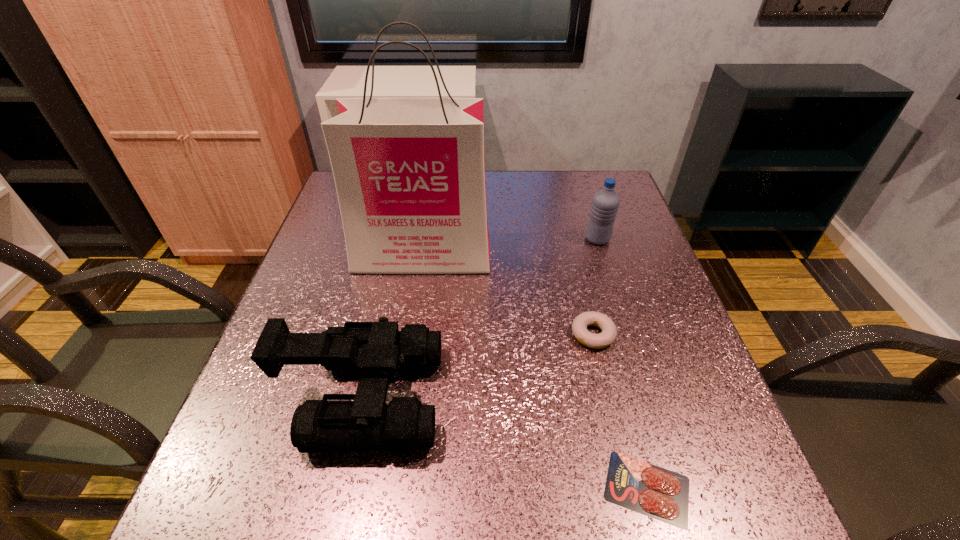
This screenshot has width=960, height=540. Find the location of `object located in the near edge section of the desktop`. object located in the near edge section of the desktop is located at coordinates (639, 486).

Locate an element on the screen. The height and width of the screenshot is (540, 960). shopping bag located at the left edge is located at coordinates (409, 173).

Find the location of a particular element. The image size is (960, 540). binoculars that is at the left edge is located at coordinates (375, 350).

At what (x,y) coordinates should I click in order to perform the action: click on water bottle situated at the right edge. Please return your answer as a coordinate pair (x, y). The width and height of the screenshot is (960, 540). Looking at the image, I should click on (605, 203).

Identify the location of doughnut positioned at the right edge. This screenshot has height=540, width=960. (608, 335).

Identify the location of salami located in the right edge section of the desktop. The height and width of the screenshot is (540, 960). (639, 486).

This screenshot has width=960, height=540. Identify the location of object positioned at the near right corner. (639, 486).

Find the location of `vacant area at the far edge`. vacant area at the far edge is located at coordinates (489, 173).

The image size is (960, 540). Find the location of `vacant space at the left edge of the desktop`. vacant space at the left edge of the desktop is located at coordinates (293, 450).

In order to click on blank space at the right edge of the desktop in this screenshot , I will do `click(671, 438)`.